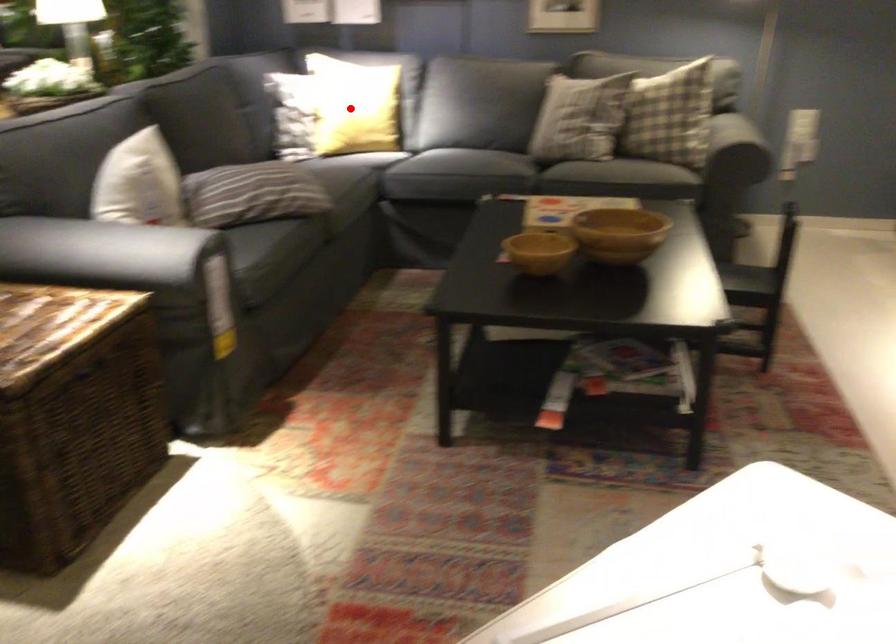
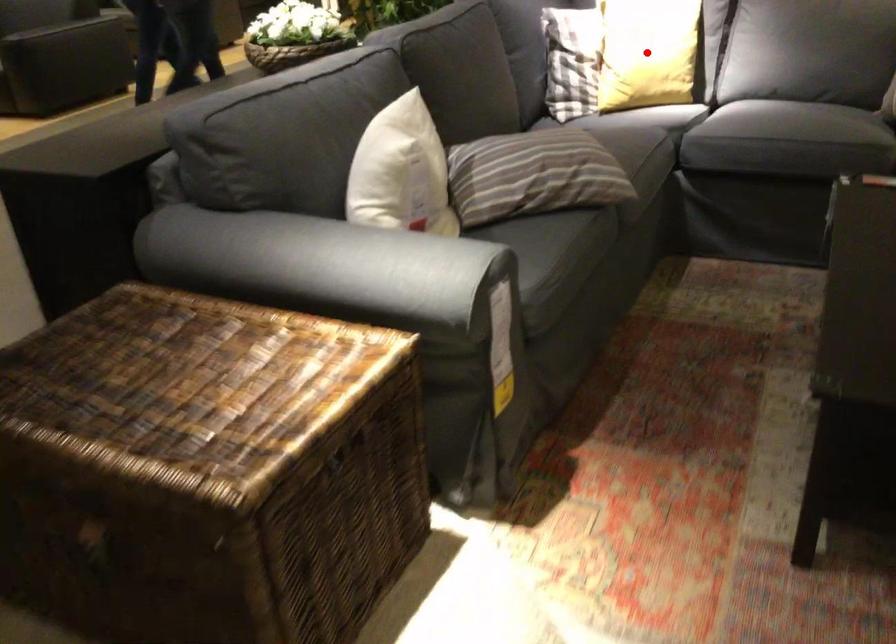
I am providing you with two images of the same scene from different viewpoints. A red point is marked on the first image and another point is marked on the second image. Does the point marked in image1 correspond to the same location as the one in image2?

Yes